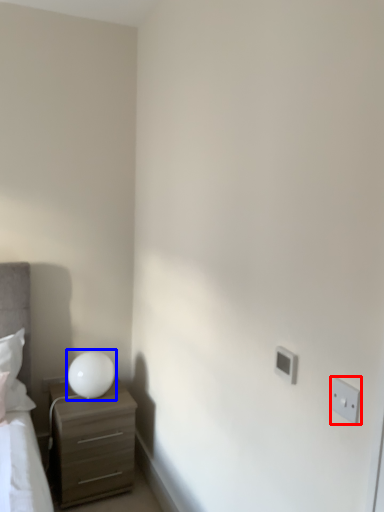
Question: Which point is closer to the camera, electric outlet (highlighted by a red box) or table lamp (highlighted by a blue box)?

Choices:
 (A) electric outlet
 (B) table lamp

Answer: (A)